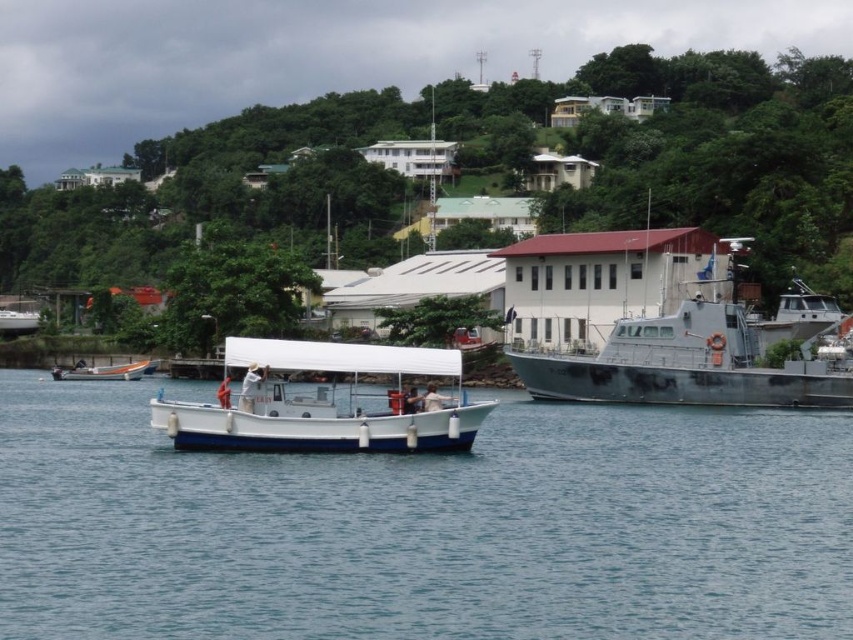
Question: Does dark gray metallic boat at right appear under white plastic boat at center?

Choices:
 (A) no
 (B) yes

Answer: (A)

Question: Which point appears farthest from the camera in this image?

Choices:
 (A) [225, 419]
 (B) [521, 499]
 (C) [531, 272]
 (D) [83, 369]

Answer: (C)

Question: Which of these objects is positioned closest to the white matte water at center?

Choices:
 (A) white plastic boat at center
 (B) white matte boat at center

Answer: (B)

Question: Is white matte boat at center thinner than white plastic boat at center?

Choices:
 (A) no
 (B) yes

Answer: (A)

Question: Which point is farther to the camera?

Choices:
 (A) (117, 365)
 (B) (106, 509)

Answer: (A)

Question: Can you confirm if white matte water at center is positioned to the right of white plastic boat at center?

Choices:
 (A) yes
 (B) no

Answer: (A)